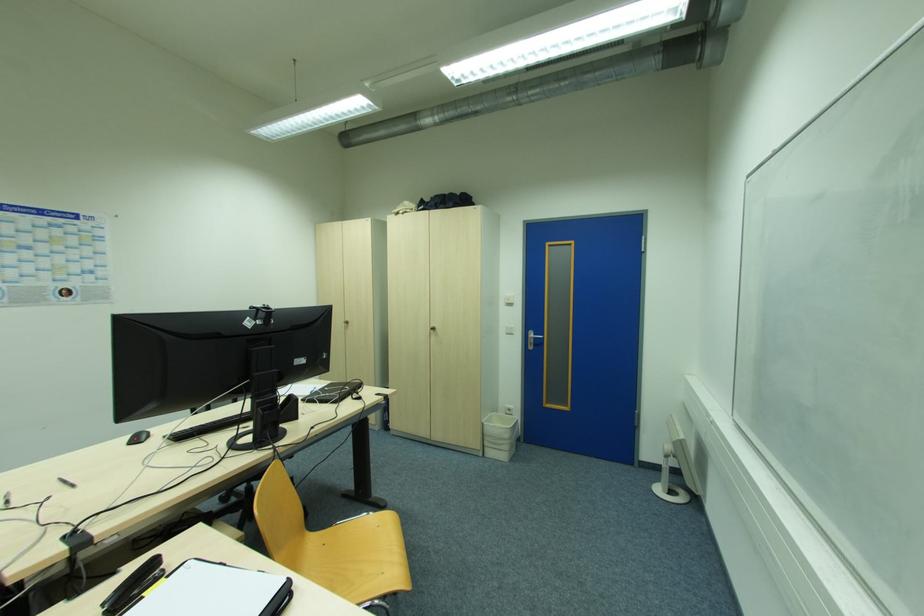
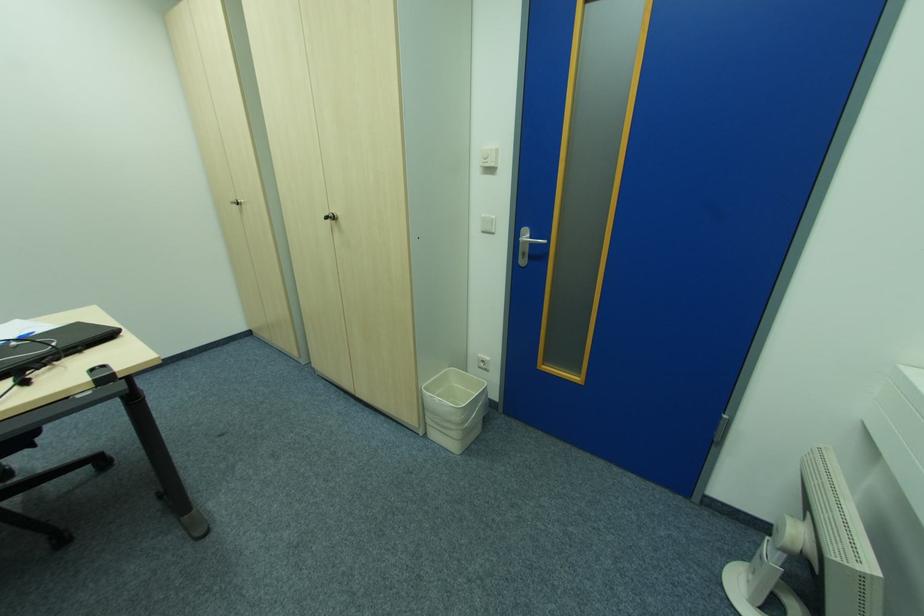
In the second image, find the point that corresponds to point 532,345 in the first image.

(526, 256)